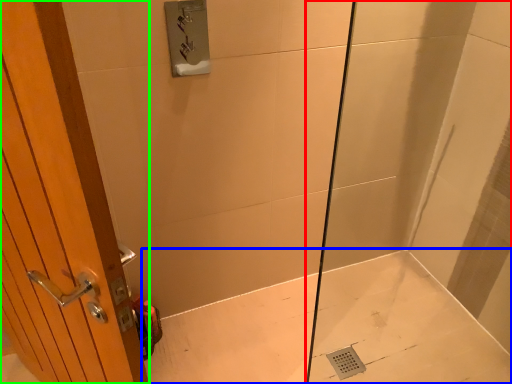
Question: Based on their relative distances, which object is nearer to shower door (highlighted by a red box)? Choose from bath (highlighted by a blue box) and door (highlighted by a green box).

Choices:
 (A) bath
 (B) door

Answer: (A)